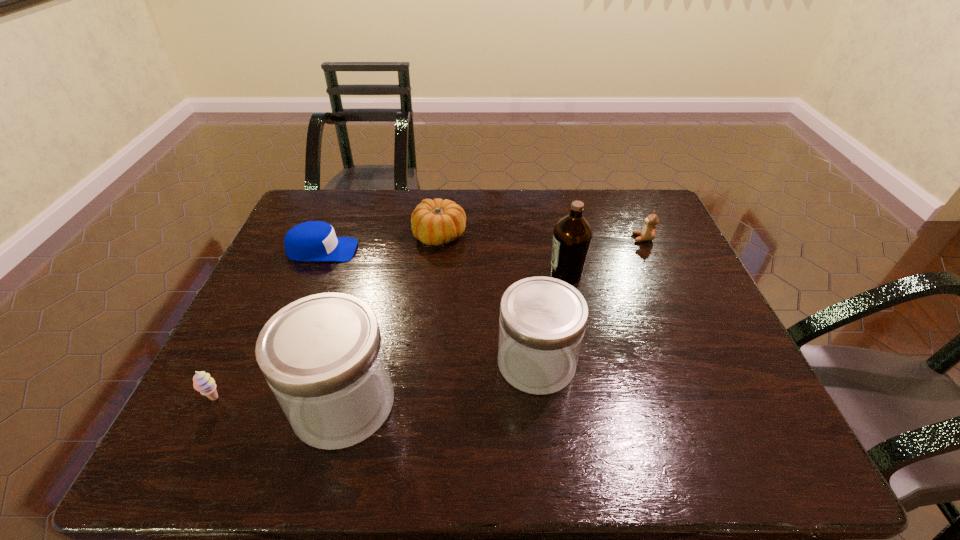
Please show where to add a jar on the right while keeping spacing even. Please provide its 2D coordinates. Your answer should be formatted as a tuple, i.e. [(x, y)], where the tuple contains the x and y coordinates of a point satisfying the conditions above.

[(702, 328)]